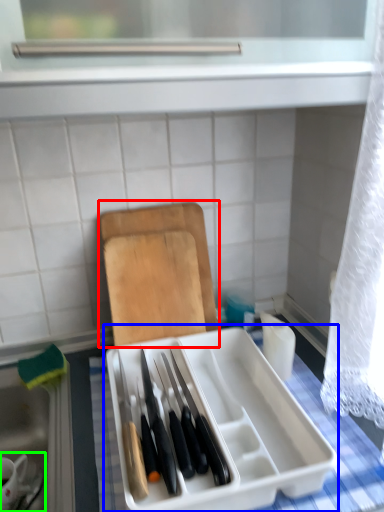
Question: Considering the real-world distances, which object is farthest from cutting board (highlighted by a red box)? appliance (highlighted by a blue box) or tableware (highlighted by a green box)?

Choices:
 (A) appliance
 (B) tableware

Answer: (B)